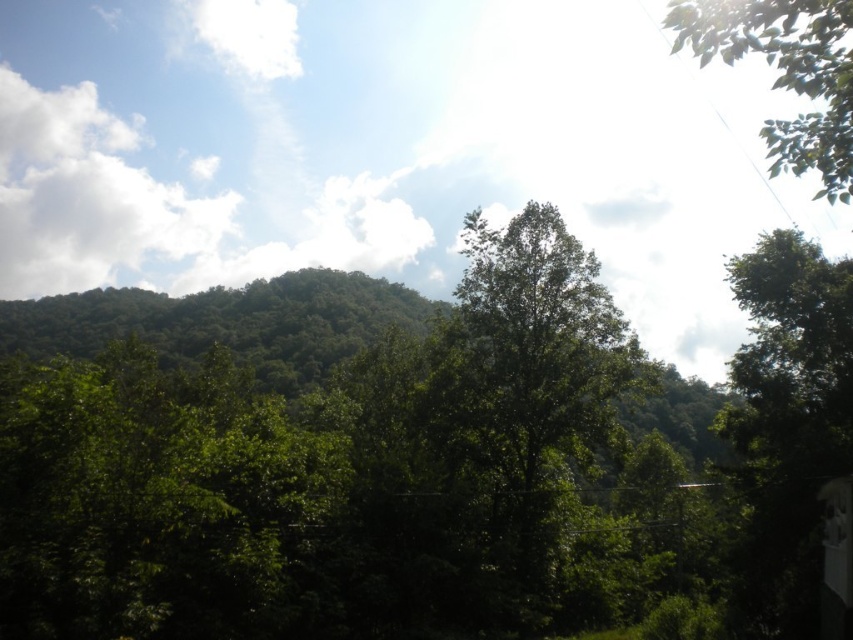
You are an environmental scientist studying tree growth patterns in a forest. You observe two trees in the scene, the green leafy tree at center and the green leafy tree at upper right. Which tree would you estimate has a shorter height based on their positions in the image?

The green leafy tree at center is smaller than the green leafy tree at upper right, so the green leafy tree at center has a shorter height.

A hiker wants to take a photo of the green leafy tree at center from a distance of 10 meters. Given that the tree is currently 15.63 meters away, should they move closer or farther away to achieve the desired distance?

The green leafy tree at center is currently 15.63 meters away from the viewer. To reach the desired distance of 10 meters, the hiker should move closer to the tree by 5.63 meters.